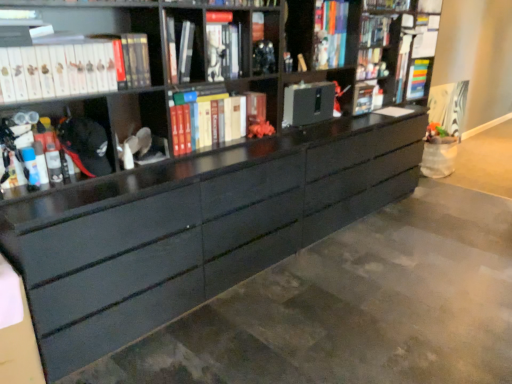
Question: Considering the relative sizes of matte black marker at left, the second book viewed from the front, and multicolored plastic book at upper right, which is the first book in right-to-left order, in the image provided, is matte black marker at left, the second book viewed from the front, bigger than multicolored plastic book at upper right, which is the first book in right-to-left order,?

Choices:
 (A) yes
 (B) no

Answer: (B)

Question: Is matte black marker at left, acting as the fifth book starting from the right, taller than multicolored plastic book at upper right, the fifth book in the left-to-right sequence?

Choices:
 (A) no
 (B) yes

Answer: (A)

Question: Is matte black marker at left, the second book viewed from the front, further to camera compared to multicolored plastic book at upper right, which is the first book in right-to-left order?

Choices:
 (A) no
 (B) yes

Answer: (A)

Question: Is matte black marker at left, acting as the fifth book starting from the right, wider than multicolored plastic book at upper right, which is the fifth book in front-to-back order?

Choices:
 (A) no
 (B) yes

Answer: (A)

Question: Is matte black marker at left, arranged as the 4th book when viewed from the back, smaller than multicolored plastic book at upper right, the fifth book in the left-to-right sequence?

Choices:
 (A) yes
 (B) no

Answer: (A)

Question: From the image's perspective, is matte black cabinet at center, positioned as the 1th cabinet in left-to-right order, located above or below hardcover books at center, acting as the 2th book starting from the back?

Choices:
 (A) below
 (B) above

Answer: (B)

Question: Is matte black cabinet at center, placed as the 2th cabinet when sorted from back to front, taller or shorter than hardcover books at center, the fourth book positioned from the front?

Choices:
 (A) tall
 (B) short

Answer: (B)

Question: Is matte black cabinet at center, the 1th cabinet from the front, bigger or smaller than hardcover books at center, the fourth book positioned from the front?

Choices:
 (A) small
 (B) big

Answer: (A)

Question: In the image, is matte black cabinet at center, positioned as the 1th cabinet in left-to-right order, positioned in front of or behind hardcover books at center, arranged as the fourth book when viewed from the left?

Choices:
 (A) behind
 (B) front

Answer: (A)

Question: Is multicolored plastic book at upper right, the 1th book positioned from the back, wider or thinner than matte black marker at left, which is the first book from left to right?

Choices:
 (A) wide
 (B) thin

Answer: (A)

Question: Considering the positions of multicolored plastic book at upper right, the 1th book positioned from the back, and matte black marker at left, the second book viewed from the front, in the image, is multicolored plastic book at upper right, the 1th book positioned from the back, bigger or smaller than matte black marker at left, the second book viewed from the front,?

Choices:
 (A) big
 (B) small

Answer: (A)

Question: From their relative heights in the image, would you say multicolored plastic book at upper right, which is the fifth book in front-to-back order, is taller or shorter than matte black marker at left, which is the first book from left to right?

Choices:
 (A) short
 (B) tall

Answer: (B)

Question: Relative to matte black marker at left, which is the first book from left to right, is multicolored plastic book at upper right, the fifth book in the left-to-right sequence, in front or behind?

Choices:
 (A) behind
 (B) front

Answer: (A)

Question: From a real-world perspective, is hardcover books at center, acting as the 2th book starting from the right, physically located above or below black matte cabinet at center, acting as the 2th cabinet starting from the left?

Choices:
 (A) above
 (B) below

Answer: (B)

Question: Based on their sizes in the image, would you say hardcover books at center, arranged as the fourth book when viewed from the left, is bigger or smaller than black matte cabinet at center, acting as the 2th cabinet starting from the left?

Choices:
 (A) big
 (B) small

Answer: (A)